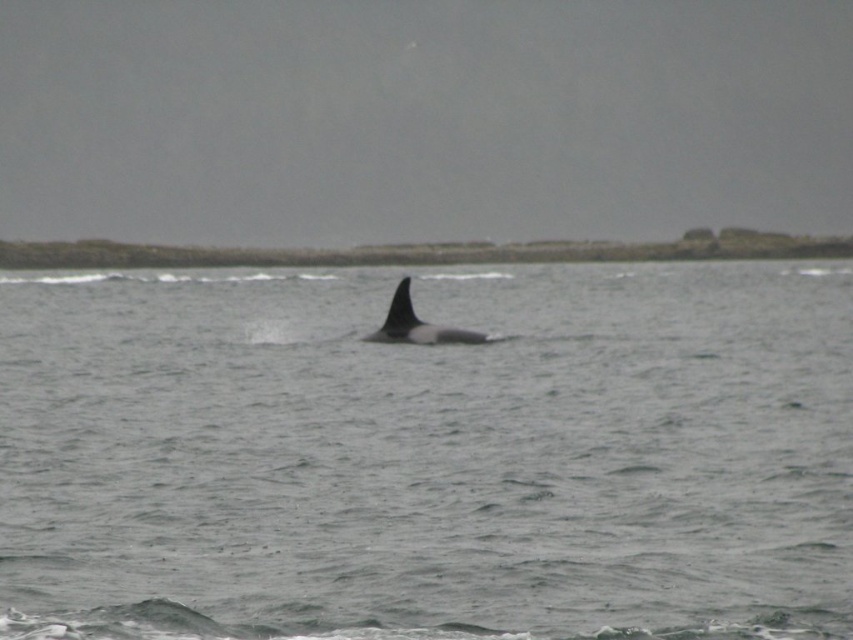
You are a marine biologist observing the sea scene. You notice the gray matte water at center and the black smooth whale at center. Which object takes up more space in the image?

The gray matte water at center has a larger size compared to the black smooth whale at center, so it takes up more space in the image.